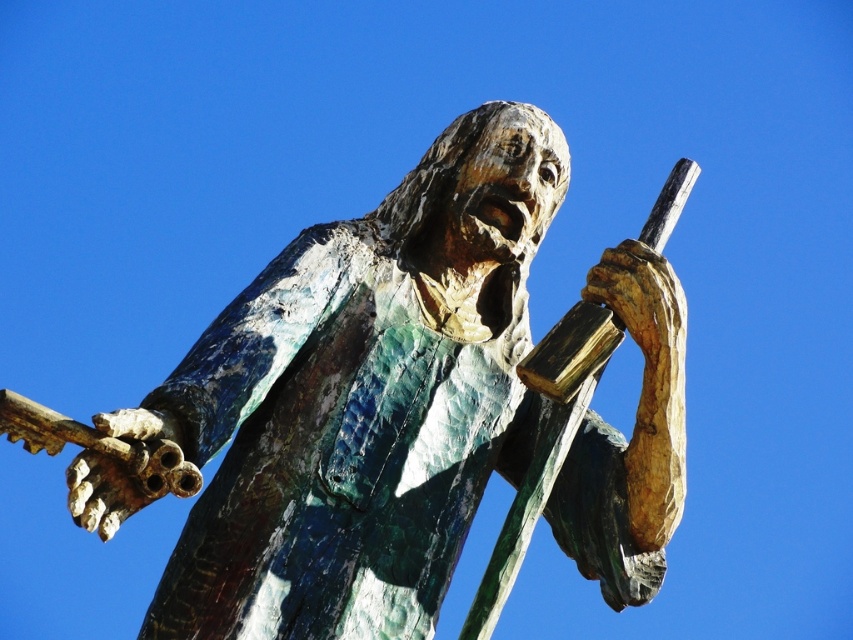
Who is higher up, green patina statue at center or bronze textured hand at upper right?

Positioned higher is bronze textured hand at upper right.

Identify the location of green patina statue at center. Image resolution: width=853 pixels, height=640 pixels. (361, 400).

Which is in front, point (515, 244) or point (631, 464)?

Positioned in front is point (631, 464).

Where is `green patina statue at center`? The height and width of the screenshot is (640, 853). green patina statue at center is located at coordinates (361, 400).